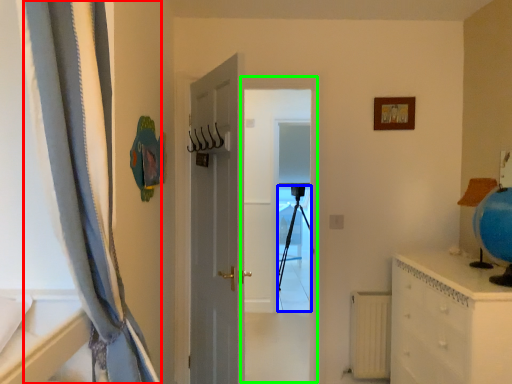
Question: Which object is positioned closest to curtain (highlighted by a red box)? Select from tripod (highlighted by a blue box) and screen door (highlighted by a green box).

Choices:
 (A) tripod
 (B) screen door

Answer: (B)